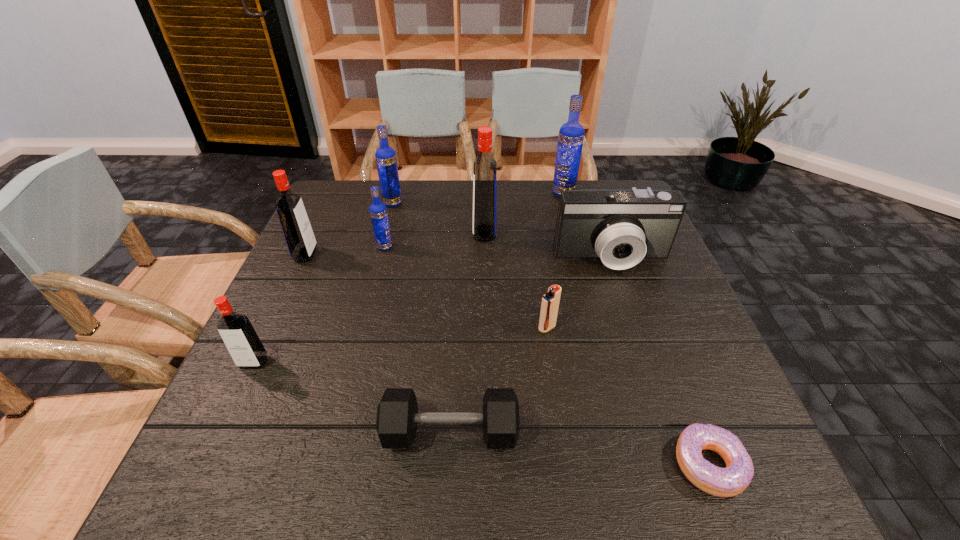
Identify the location of vacant point located between the second shortest object and the second smallest blue vodka. (421, 318).

Identify the location of free spot between the biggest red vodka and the seventh farthest object. (516, 280).

The height and width of the screenshot is (540, 960). Identify the location of vacant point located between the shortest object and the rightmost red vodka. (596, 349).

At what (x,y) coordinates should I click in order to perform the action: click on vacant area that lies between the dumbbell and the purple doughnut. Please return your answer as a coordinate pair (x, y). Looking at the image, I should click on (580, 449).

Find the location of `vacant space that's between the nearest blue vodka and the nearest vodka`. vacant space that's between the nearest blue vodka and the nearest vodka is located at coordinates (319, 305).

Where is `free space between the shortest object and the nearest blue vodka`? free space between the shortest object and the nearest blue vodka is located at coordinates (546, 356).

Choose which object is the third nearest neighbor to the rightmost red vodka. Please provide its 2D coordinates. Your answer should be formatted as a tuple, i.e. [(x, y)], where the tuple contains the x and y coordinates of a point satisfying the conditions above.

[(571, 134)]

This screenshot has height=540, width=960. In order to click on object that is the seventh closest one to the seventh object from left to right in this screenshot , I will do `click(246, 349)`.

The image size is (960, 540). I want to click on vodka that can be found as the second closest to the nearest blue vodka, so click(x=386, y=161).

Identify the location of vodka that is the sixth nearest to the black camcorder. (246, 349).